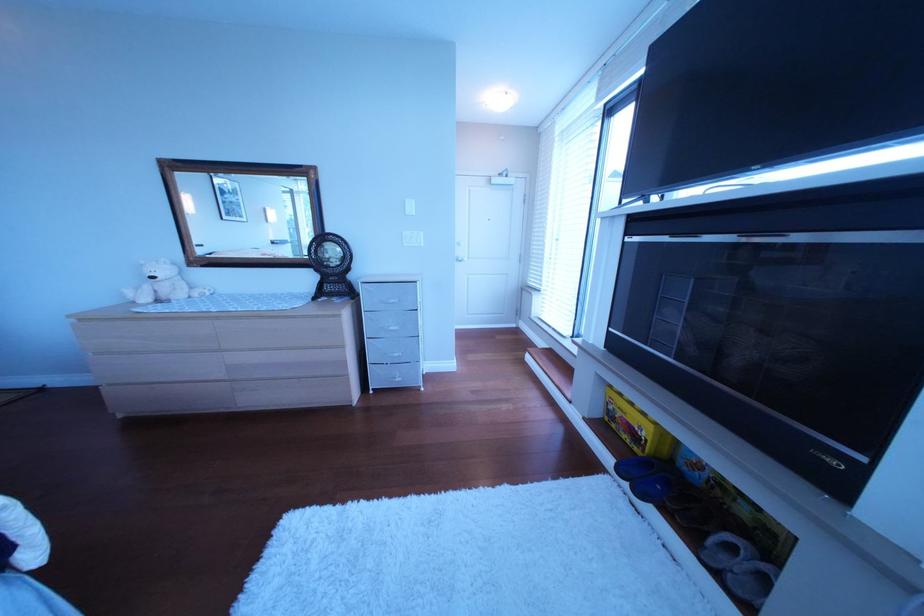
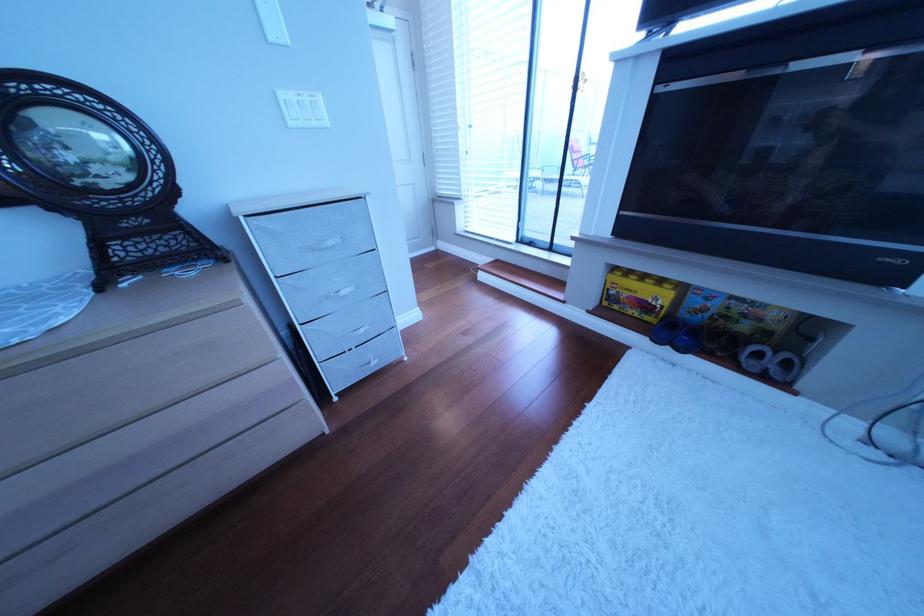
The point at (659,454) is marked in the first image. Where is the corresponding point in the second image?

(672, 320)